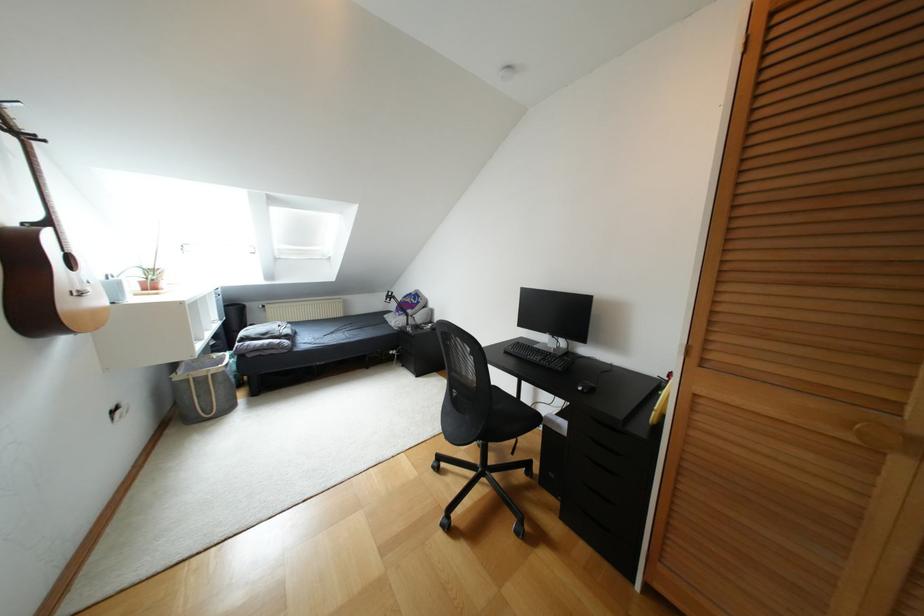
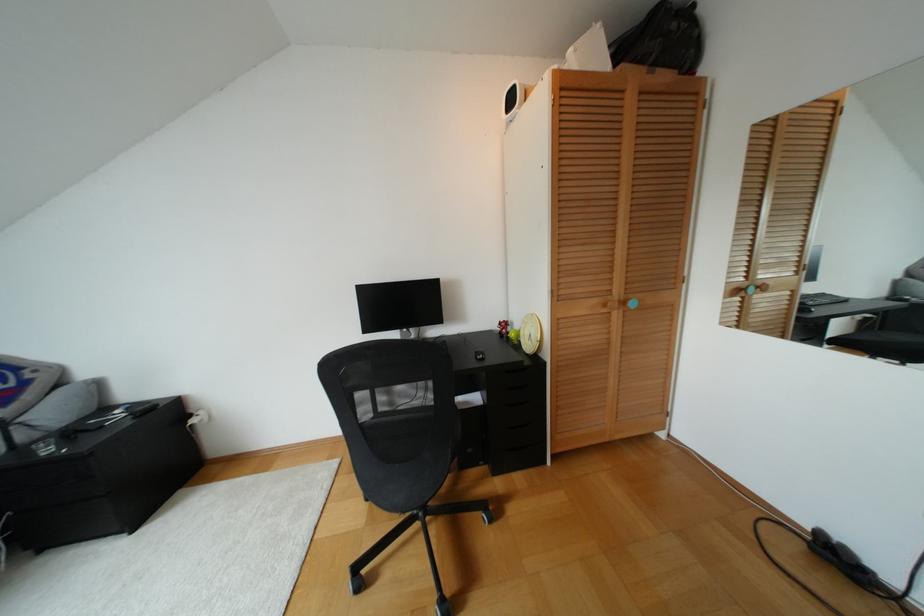
Question: The camera is either moving clockwise (left) or counter-clockwise (right) around the object. The first image is from the beginning of the video and the second image is from the end. Is the camera moving left or right when shooting the video?

Choices:
 (A) Left
 (B) Right

Answer: (A)